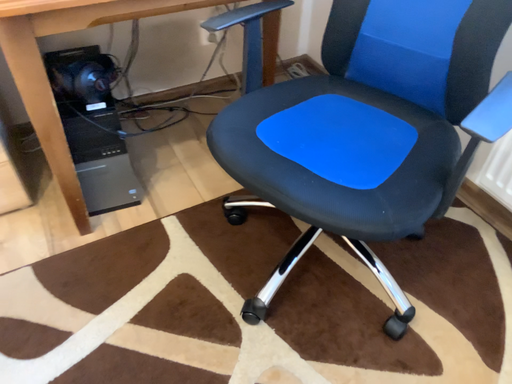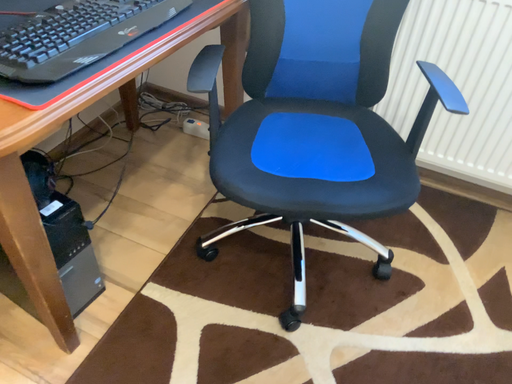
Question: Which way did the camera rotate in the video?

Choices:
 (A) rotated left
 (B) rotated right

Answer: (B)